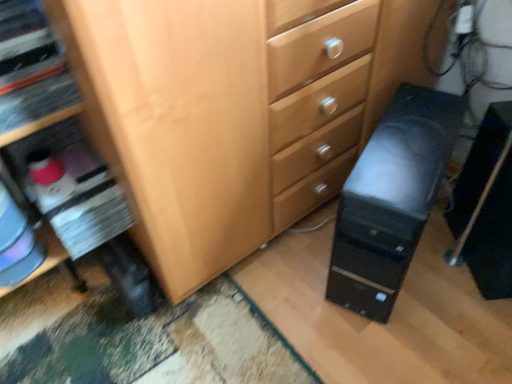
Locate an element on the screen. This screenshot has height=384, width=512. vacant space positioned to the left of black plastic computer tower at lower right, the 2th computer tower positioned from the left is located at coordinates (432, 284).